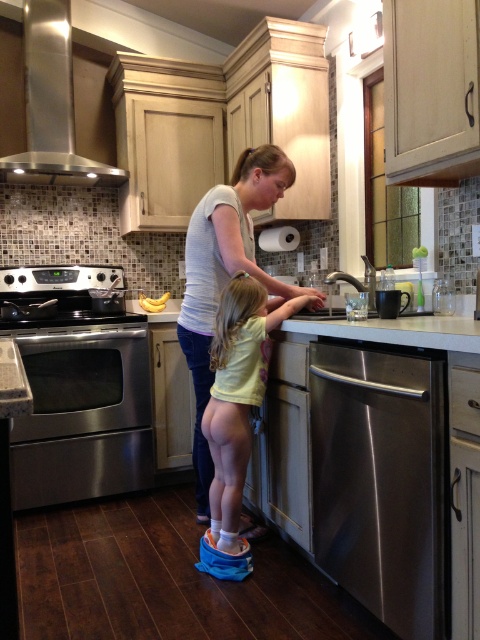
You are a chef preparing ingredients and need to place the yellow matte bananas at center into the stainless steel dishwasher at lower right. Can you directly put them into the dishwasher without moving any objects in the way?

The stainless steel dishwasher at lower right is in front of the yellow matte bananas at center, so the bananas are behind the dishwasher. Therefore, you cannot directly place the bananas into the dishwasher without moving the dishwasher first.